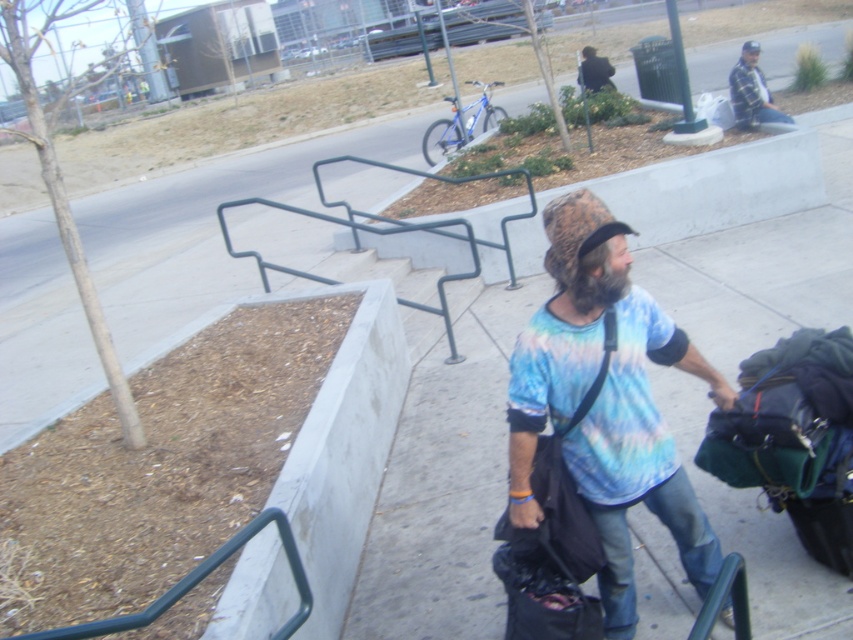
Does beardedhairman at center have a lesser height compared to dark blue jacket at upper center?

Yes, beardedhairman at center is shorter than dark blue jacket at upper center.

Does beardedhairman at center have a smaller size compared to dark blue jacket at upper center?

Correct, beardedhairman at center occupies less space than dark blue jacket at upper center.

Does point (595, 294) lie behind point (579, 68)?

No, (595, 294) is in front of (579, 68).

At what (x,y) coordinates should I click in order to perform the action: click on beardedhairman at center. Please return your answer as a coordinate pair (x, y). Image resolution: width=853 pixels, height=640 pixels. Looking at the image, I should click on (596, 282).

Is point (753, 102) positioned in front of point (606, 266)?

No, it is behind (606, 266).

This screenshot has width=853, height=640. What do you see at coordinates (751, 92) in the screenshot?
I see `plaid flannel shirt at upper right` at bounding box center [751, 92].

Does point (750, 67) lie behind point (567, 298)?

Yes, point (750, 67) is farther from viewer.

You are a GUI agent. You are given a task and a screenshot of the screen. Output one action in this format:
    pyautogui.click(x=<x>, y=<y>)
    Task: Click on the plaid flannel shirt at upper right
    The width and height of the screenshot is (853, 640).
    Given the screenshot: What is the action you would take?
    pyautogui.click(x=751, y=92)

Is tie-dye fabric shirt at center bigger than green matte rail at lower left?

Yes, tie-dye fabric shirt at center is bigger than green matte rail at lower left.

Can you confirm if tie-dye fabric shirt at center is taller than green matte rail at lower left?

Yes.

The height and width of the screenshot is (640, 853). What are the coordinates of `tie-dye fabric shirt at center` in the screenshot? It's located at (606, 410).